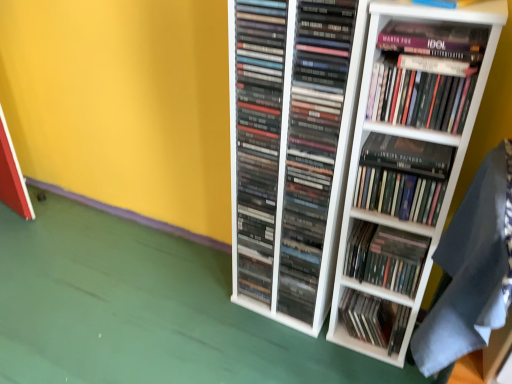
This screenshot has width=512, height=384. Describe the element at coordinates (385, 257) in the screenshot. I see `matte black books at center, the sixth book when ordered from top to bottom` at that location.

In order to face hardcover book at upper right, which is the 1th book from top to bottom, should I rotate leftwards or rightwards?

To align with it, rotate right about 21.491°.

Identify the location of matte black books at center, acting as the 3th book starting from the bottom. (315, 146).

Find the location of a particular element. The height and width of the screenshot is (384, 512). matte purple paperback book at upper right is located at coordinates (435, 40).

At what (x,y) coordinates should I click in order to perform the action: click on black matte book at upper right, which appears as the 6th book when ordered from the bottom. Please return your answer as a coordinate pair (x, y). The height and width of the screenshot is (384, 512). Looking at the image, I should click on [408, 155].

The image size is (512, 384). What do you see at coordinates (374, 319) in the screenshot? I see `matte black book at center, which appears as the 7th book when viewed from the top` at bounding box center [374, 319].

The image size is (512, 384). I want to click on matte black books at center, which is the second book from bottom to top, so click(x=385, y=257).

From a real-world perspective, is matte black book at center, which appears as the 7th book when viewed from the top, over matte black books at center, which appears as the fifth book when viewed from the top?

No.

From the image's perspective, relative to matte black books at center, which appears as the fifth book when viewed from the top, is matte black book at center, positioned as the first book in bottom-to-top order, above or below?

Based on their image positions, matte black book at center, positioned as the first book in bottom-to-top order, is located beneath matte black books at center, which appears as the fifth book when viewed from the top.

The image size is (512, 384). I want to click on the 5th book in front of the matte black book at center, which appears as the 7th book when viewed from the top, so click(x=315, y=146).

Does white matte bookshelf at center have a greater width compared to hardcover book at upper right, which ranks as the seventh book in bottom-to-top order?

Yes.

Are white matte bookshelf at center and hardcover book at upper right, which ranks as the seventh book in bottom-to-top order, making contact?

No, white matte bookshelf at center is not in contact with hardcover book at upper right, which ranks as the seventh book in bottom-to-top order.

From the image's perspective, which object appears higher, white matte bookshelf at center or hardcover book at upper right, which ranks as the seventh book in bottom-to-top order?

From the image's view, hardcover book at upper right, which ranks as the seventh book in bottom-to-top order, is above.

In the image, is dark gray fabric at lower right positioned in front of or behind hardcover books at center, positioned as the fourth book in bottom-to-top order?

dark gray fabric at lower right is in front of hardcover books at center, positioned as the fourth book in bottom-to-top order.

At what (x,y) coordinates should I click in order to perform the action: click on material that appears on the right of hardcover books at center, positioned as the fourth book in top-to-bottom order. Please return your answer as a coordinate pair (x, y). The height and width of the screenshot is (384, 512). Looking at the image, I should click on (472, 269).

Based on the photo, is dark gray fabric at lower right situated inside hardcover books at center, positioned as the fourth book in bottom-to-top order, or outside?

dark gray fabric at lower right is spatially situated outside hardcover books at center, positioned as the fourth book in bottom-to-top order.

Is dark gray fabric at lower right next to hardcover books at center, positioned as the fourth book in top-to-bottom order, and touching it?

No, dark gray fabric at lower right is not touching hardcover books at center, positioned as the fourth book in top-to-bottom order.

Can you confirm if hardcover books at center, positioned as the fourth book in bottom-to-top order, is shorter than white matte bookshelf at center?

Correct, hardcover books at center, positioned as the fourth book in bottom-to-top order, is not as tall as white matte bookshelf at center.

From the image's perspective, which object appears higher, hardcover books at center, positioned as the fourth book in top-to-bottom order, or white matte bookshelf at center?

hardcover books at center, positioned as the fourth book in top-to-bottom order, is shown above in the image.

Based on the photo, is white matte bookshelf at center completely or partially inside hardcover books at center, positioned as the fourth book in bottom-to-top order?

No, hardcover books at center, positioned as the fourth book in bottom-to-top order, does not contain white matte bookshelf at center.

Does point (469, 222) appear closer or farther from the camera than point (265, 224)?

Point (469, 222).

Is the position of dark gray fabric at lower right more distant than that of matte black cds at center, the fifth book from the bottom?

No, dark gray fabric at lower right is closer to the camera.

Considering the relative sizes of dark gray fabric at lower right and matte black cds at center, the fifth book from the bottom, in the image provided, is dark gray fabric at lower right thinner than matte black cds at center, the fifth book from the bottom,?

In fact, dark gray fabric at lower right might be wider than matte black cds at center, the fifth book from the bottom.

Based on the photo, from the image's perspective, which one is positioned lower, dark gray fabric at lower right or matte black cds at center, the fifth book from the bottom?

From the image's view, dark gray fabric at lower right is below.

Is hardcover books at center, positioned as the fourth book in bottom-to-top order, not near matte black books at center, which is the second book from bottom to top?

That's not correct — hardcover books at center, positioned as the fourth book in bottom-to-top order, is a little close to matte black books at center, which is the second book from bottom to top.

How far apart are hardcover books at center, positioned as the fourth book in top-to-bottom order, and matte black books at center, which is the second book from bottom to top?

hardcover books at center, positioned as the fourth book in top-to-bottom order, and matte black books at center, which is the second book from bottom to top, are 15.00 centimeters apart from each other.

In the scene shown: Between hardcover books at center, positioned as the fourth book in top-to-bottom order, and matte black books at center, the sixth book when ordered from top to bottom, which one has smaller width?

With smaller width is hardcover books at center, positioned as the fourth book in top-to-bottom order.

From a real-world perspective, is hardcover books at center, positioned as the fourth book in top-to-bottom order, below matte black books at center, the sixth book when ordered from top to bottom?

Actually, hardcover books at center, positioned as the fourth book in top-to-bottom order, is physically above matte black books at center, the sixth book when ordered from top to bottom, in the real world.

Is matte purple paperback book at upper right located outside hardcover book at upper right, which ranks as the seventh book in bottom-to-top order?

Yes, matte purple paperback book at upper right is outside of hardcover book at upper right, which ranks as the seventh book in bottom-to-top order.

Can you confirm if matte purple paperback book at upper right is smaller than hardcover book at upper right, which is the 1th book from top to bottom?

Correct, matte purple paperback book at upper right occupies less space than hardcover book at upper right, which is the 1th book from top to bottom.

Does matte purple paperback book at upper right turn towards hardcover book at upper right, which ranks as the seventh book in bottom-to-top order?

No, matte purple paperback book at upper right is not aimed at hardcover book at upper right, which ranks as the seventh book in bottom-to-top order.

I want to click on the 3rd book directly beneath the matte black books at center, which appears as the fifth book when viewed from the top (from a real-world perspective), so click(x=374, y=319).

Starting from the white matte bookshelf at center, which book is the 3rd one to the left? Please provide its 2D coordinates.

[(426, 74)]

When comparing their distances from dark gray fabric at lower right, does matte black books at center, which appears as the fifth book when viewed from the top, or matte black book at center, which appears as the 7th book when viewed from the top, seem closer?

Based on the image, matte black books at center, which appears as the fifth book when viewed from the top, appears to be nearer to dark gray fabric at lower right.

Which object lies further to the anchor point matte black book at center, positioned as the first book in bottom-to-top order, matte black books at center, which is the second book from bottom to top, or matte black books at center, which appears as the fifth book when viewed from the top?

matte black books at center, which appears as the fifth book when viewed from the top.

From the image, which object appears to be nearer to matte purple paperback book at upper right, dark gray fabric at lower right or hardcover books at center, positioned as the fourth book in bottom-to-top order?

Based on the image, hardcover books at center, positioned as the fourth book in bottom-to-top order, appears to be nearer to matte purple paperback book at upper right.

Consider the image. Considering their positions, is matte purple paperback book at upper right positioned further to matte black books at center, which is the second book from bottom to top, than matte black books at center, acting as the 3th book starting from the bottom?

The object further to matte black books at center, which is the second book from bottom to top, is matte purple paperback book at upper right.

Considering their positions, is white matte bookshelf at center positioned closer to dark gray fabric at lower right than matte black book at center, which appears as the 7th book when viewed from the top?

white matte bookshelf at center is closer to dark gray fabric at lower right.

Looking at the image, which one is located further to white matte bookshelf at center, hardcover book at upper right, which is the 1th book from top to bottom, or matte black book at center, which appears as the 7th book when viewed from the top?

matte black book at center, which appears as the 7th book when viewed from the top.

Considering their positions, is matte black book at center, positioned as the first book in bottom-to-top order, positioned further to hardcover books at center, positioned as the fourth book in bottom-to-top order, than white matte bookshelf at center?

matte black book at center, positioned as the first book in bottom-to-top order.

From the image, which object appears to be farther from matte black books at center, which appears as the fifth book when viewed from the top, hardcover books at center, positioned as the fourth book in top-to-bottom order, or hardcover book at upper right, which ranks as the seventh book in bottom-to-top order?

Among the two, hardcover book at upper right, which ranks as the seventh book in bottom-to-top order, is located further to matte black books at center, which appears as the fifth book when viewed from the top.

Where is `shelf between matte purple paperback book at upper right and matte black book at center, which appears as the 7th book when viewed from the top, from top to bottom`? Image resolution: width=512 pixels, height=384 pixels. shelf between matte purple paperback book at upper right and matte black book at center, which appears as the 7th book when viewed from the top, from top to bottom is located at coordinates (406, 165).

Locate an element on the screen. material between matte purple paperback book at upper right and matte black book at center, positioned as the first book in bottom-to-top order, from top to bottom is located at coordinates (472, 269).

Identify the location of shelf between hardcover book at upper right, which ranks as the seventh book in bottom-to-top order, and matte black book at center, which appears as the 7th book when viewed from the top, in the up-down direction. This screenshot has height=384, width=512. (406, 165).

Identify the location of paperback book between matte black cds at center, which is the third book from top to bottom, and black matte book at upper right, which is the second book in top-to-bottom order. The image size is (512, 384). (435, 40).